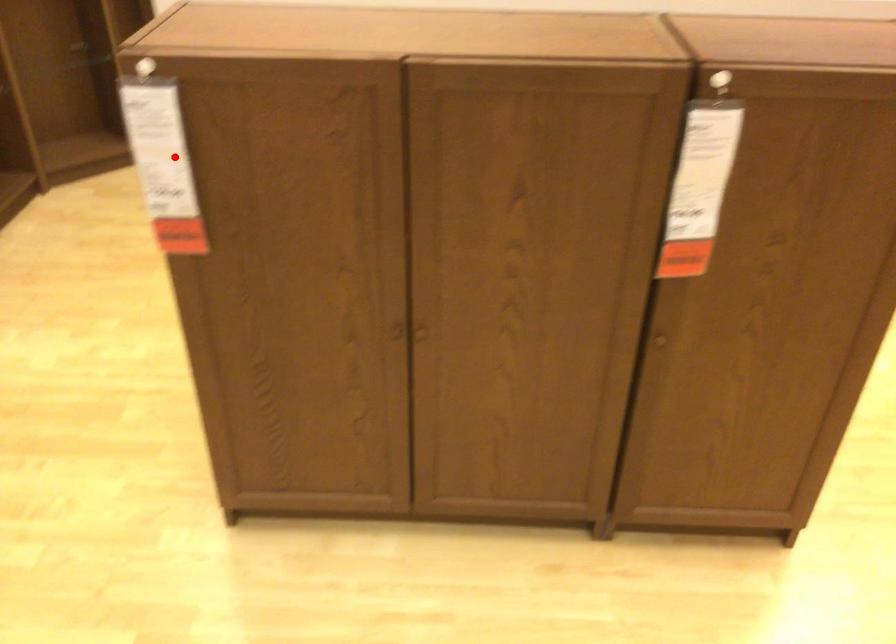
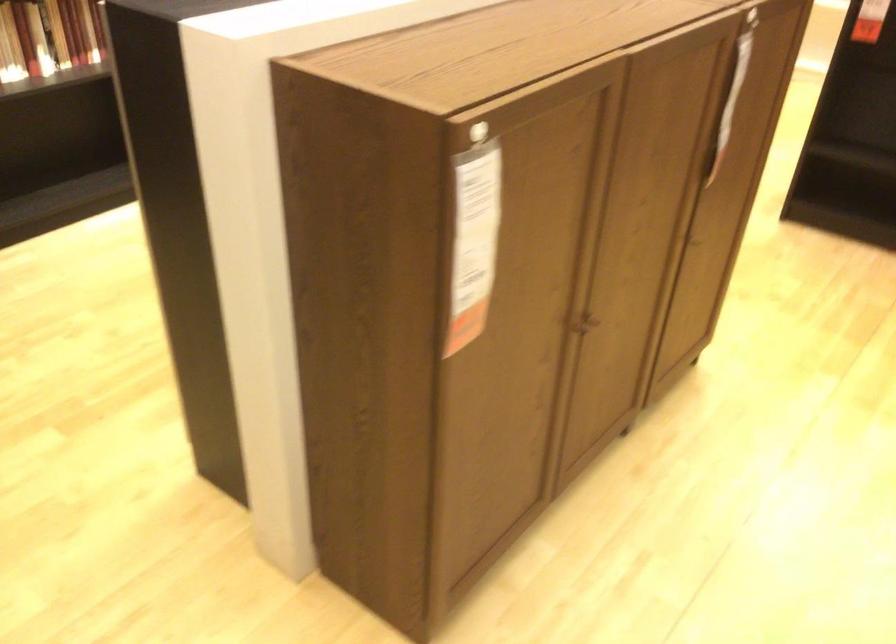
Question: I am providing you with two images of the same scene from different viewpoints. In image1, a red point is highlighted. Considering the same 3D point in image2, which of the following is correct?

Choices:
 (A) It is closer
 (B) It is farther

Answer: (A)